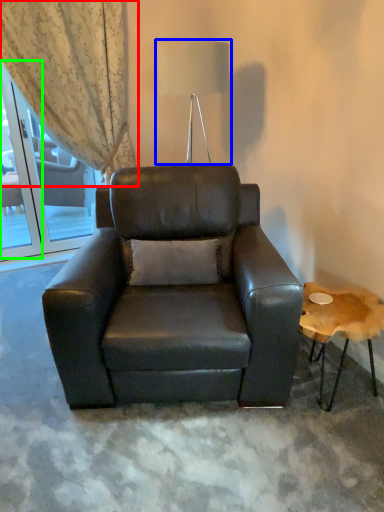
Question: Based on their relative distances, which object is nearer to curtain (highlighted by a red box)? Choose from table lamp (highlighted by a blue box) and screen door (highlighted by a green box).

Choices:
 (A) table lamp
 (B) screen door

Answer: (B)